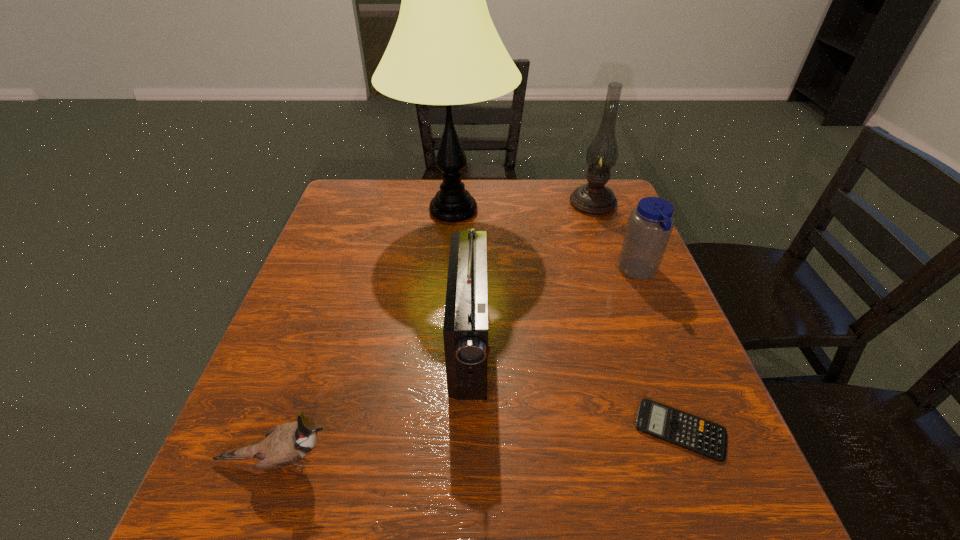
Image resolution: width=960 pixels, height=540 pixels. I want to click on the second closest object to the lamp, so click(x=594, y=198).

Locate an element on the screen. The width and height of the screenshot is (960, 540). vacant region that satisfies the following two spatial constraints: 1. on the back side of the oil lamp; 2. on the left side of the lamp is located at coordinates (454, 202).

Locate an element on the screen. This screenshot has height=540, width=960. free space that satisfies the following two spatial constraints: 1. on the front-facing side of the third tallest object; 2. on the back side of the shortest object is located at coordinates (468, 430).

Where is `free region that satisfies the following two spatial constraints: 1. on the front side of the oil lamp; 2. at the face of the fifth tallest object`? Image resolution: width=960 pixels, height=540 pixels. free region that satisfies the following two spatial constraints: 1. on the front side of the oil lamp; 2. at the face of the fifth tallest object is located at coordinates (683, 461).

The width and height of the screenshot is (960, 540). What are the coordinates of `vacant position in the image that satisfies the following two spatial constraints: 1. on the front-facing side of the calculator; 2. on the left side of the radio receiver` in the screenshot? It's located at (468, 430).